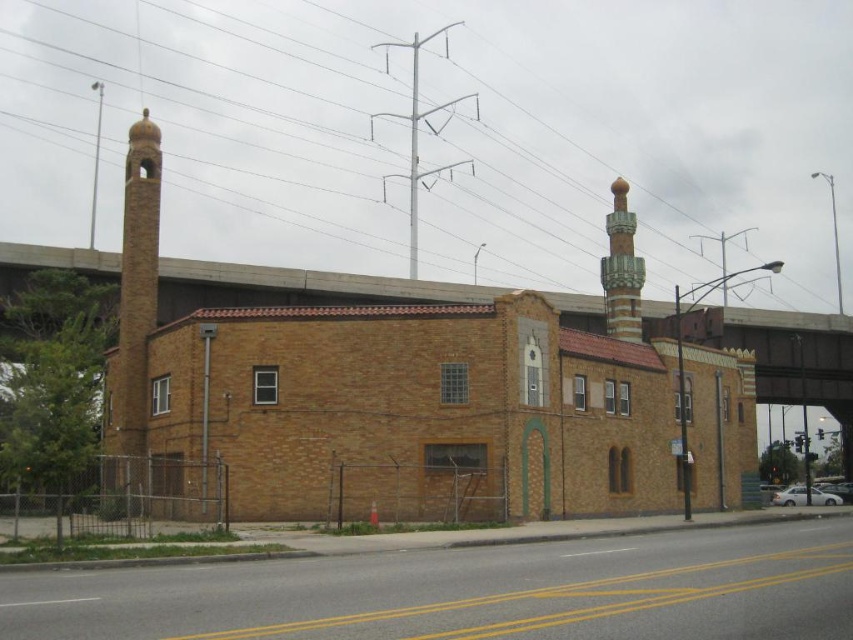
Does brown brick overpass at upper center appear on the right side of green glazed tile minaret at upper right?

Correct, you'll find brown brick overpass at upper center to the right of green glazed tile minaret at upper right.

Can you confirm if brown brick overpass at upper center is shorter than green glazed tile minaret at upper right?

No, brown brick overpass at upper center is not shorter than green glazed tile minaret at upper right.

You are a GUI agent. You are given a task and a screenshot of the screen. Output one action in this format:
    pyautogui.click(x=<x>, y=<y>)
    Task: Click on the brown brick overpass at upper center
    The width and height of the screenshot is (853, 640).
    Given the screenshot: What is the action you would take?
    pyautogui.click(x=786, y=353)

Between metallic gray power line at upper center and brown brick overpass at upper center, which one has more height?

With more height is metallic gray power line at upper center.

Is point (354, 180) farther from camera compared to point (827, 401)?

Yes, point (354, 180) is farther from viewer.

Where is `metallic gray power line at upper center`? metallic gray power line at upper center is located at coordinates (450, 129).

Measure the distance from metallic gray power line at upper center to green glazed tile minaret at upper right.

metallic gray power line at upper center is 116.05 meters away from green glazed tile minaret at upper right.

In the scene shown: Who is positioned more to the left, metallic gray power line at upper center or green glazed tile minaret at upper right?

From the viewer's perspective, metallic gray power line at upper center appears more on the left side.

Describe the element at coordinates (450, 129) in the screenshot. The width and height of the screenshot is (853, 640). I see `metallic gray power line at upper center` at that location.

The image size is (853, 640). What are the coordinates of `metallic gray power line at upper center` in the screenshot? It's located at (450, 129).